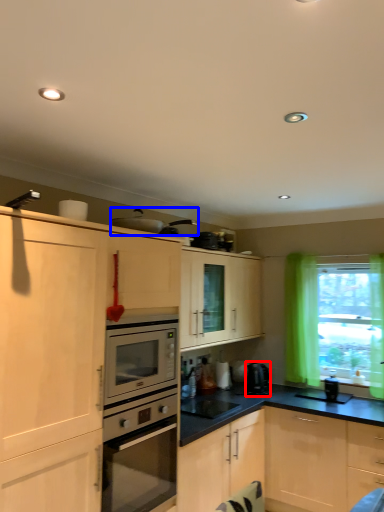
Question: Among these objects, which one is nearest to the camera, coffee machine (highlighted by a red box) or appliance (highlighted by a blue box)?

Choices:
 (A) coffee machine
 (B) appliance

Answer: (B)